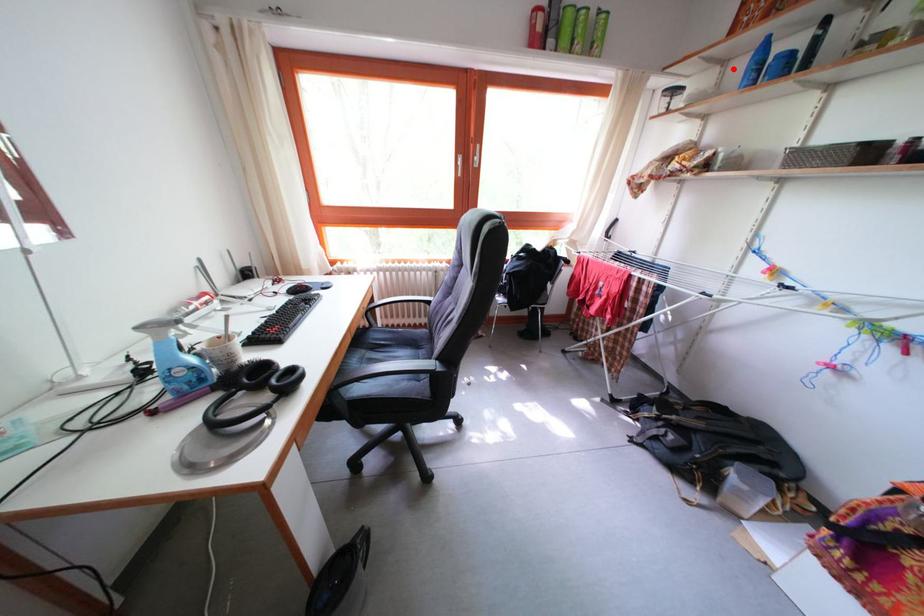
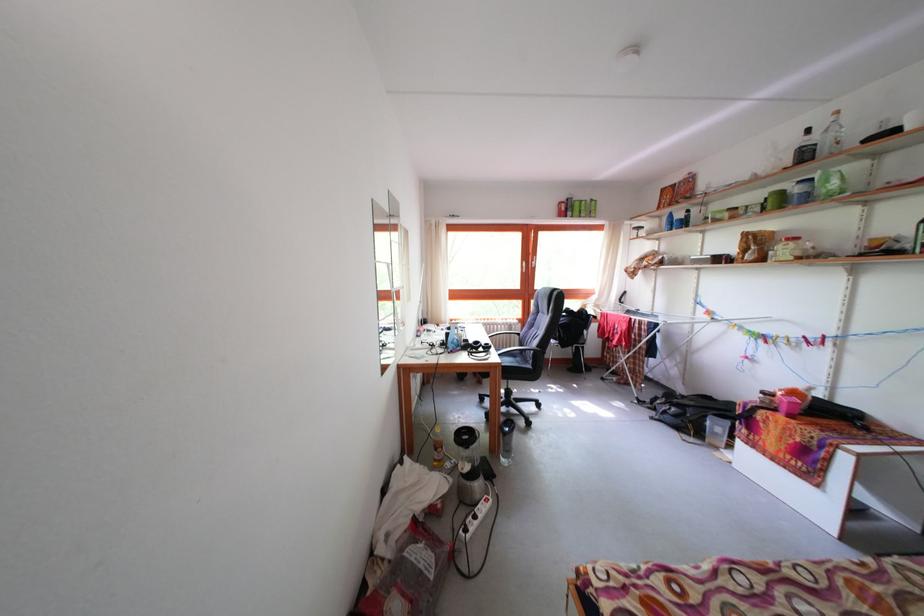
The point at the highlighted location is marked in the first image. Where is the corresponding point in the second image?

(667, 224)